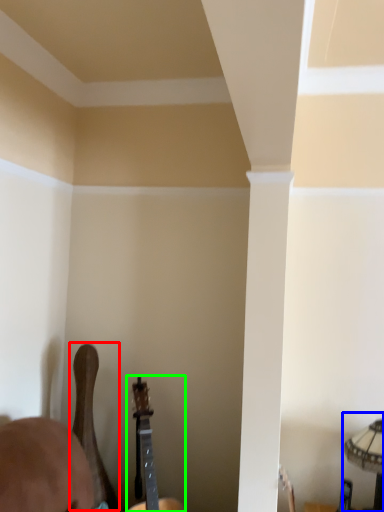
Question: Considering the real-world distances, which object is closest to guitar (highlighted by a red box)? lamp (highlighted by a blue box) or guitar (highlighted by a green box).

Choices:
 (A) lamp
 (B) guitar

Answer: (B)